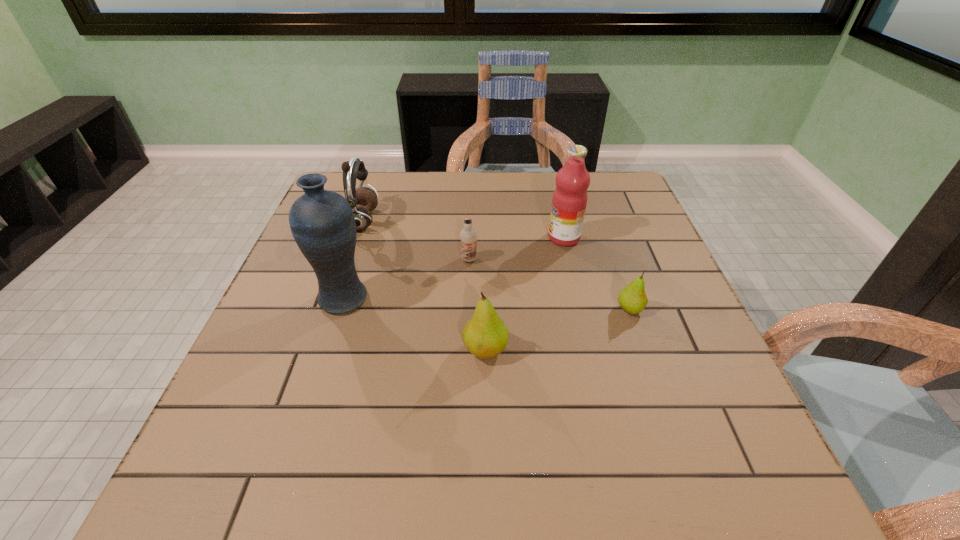
Given the evenly spaced pears in the image, where should an extra pear be added on the left to preserve the spacing? Please point to a vacant space. Please provide its 2D coordinates. Your answer should be formatted as a tuple, i.e. [(x, y)], where the tuple contains the x and y coordinates of a point satisfying the conditions above.

[(311, 398)]